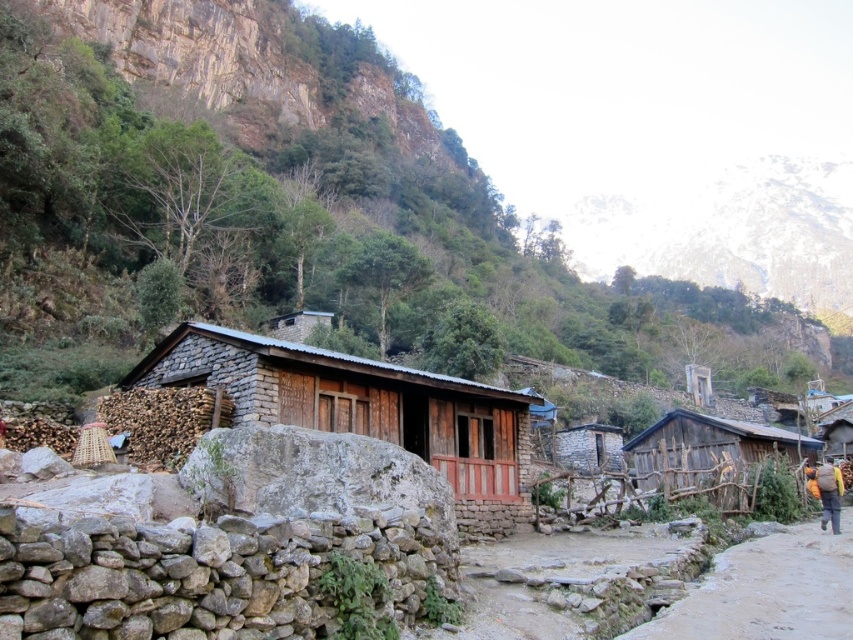
Question: Can you confirm if wooden fence at right is thinner than brown fabric backpack at right?

Choices:
 (A) yes
 (B) no

Answer: (B)

Question: Which point is farther to the camera?

Choices:
 (A) brown fabric backpack at right
 (B) wooden hut at center
 (C) dirt path at lower right
 (D) rough stone mountain at upper left

Answer: (D)

Question: Can you confirm if rough stone mountain at upper left is thinner than brown fabric backpack at right?

Choices:
 (A) yes
 (B) no

Answer: (B)

Question: Considering the real-world distances, which object is closest to the rough stone mountain at upper left?

Choices:
 (A) wooden hut at center
 (B) brown fabric backpack at right
 (C) wooden fence at right

Answer: (C)

Question: Which of the following is the farthest from the observer?

Choices:
 (A) (761, 563)
 (B) (444, 432)

Answer: (B)

Question: Can you confirm if wooden fence at right is positioned below brown fabric backpack at right?

Choices:
 (A) no
 (B) yes

Answer: (B)